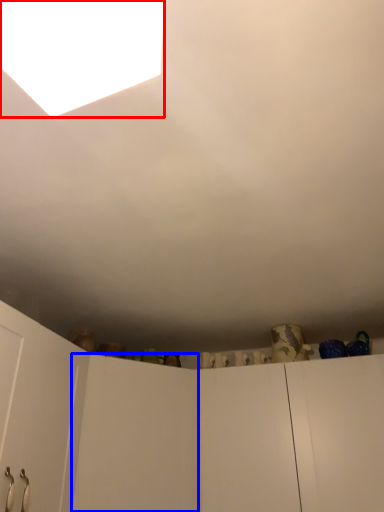
Question: Among these objects, which one is nearest to the camera, light (highlighted by a red box) or door (highlighted by a blue box)?

Choices:
 (A) light
 (B) door

Answer: (A)